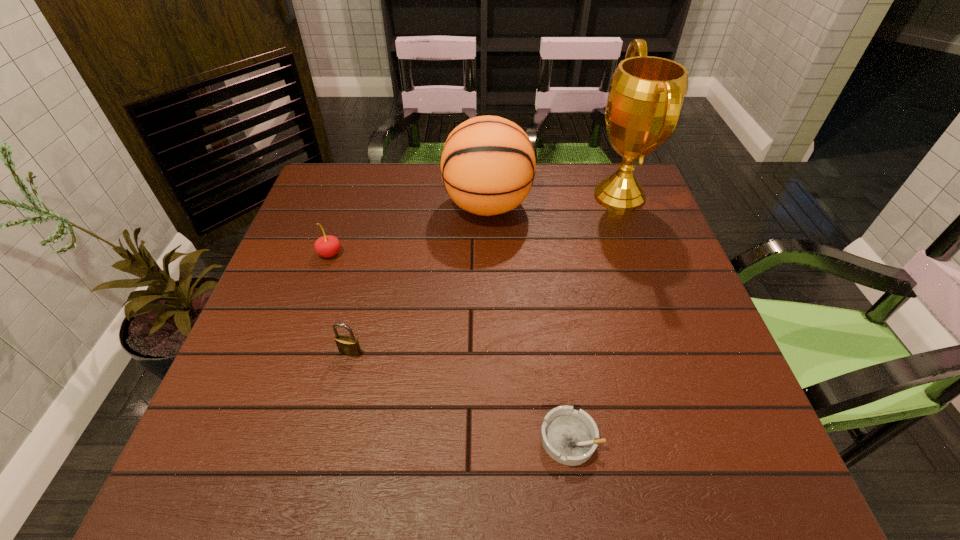
Find the location of a particular element. The width and height of the screenshot is (960, 540). empty space between the nearest object and the cherry is located at coordinates (450, 346).

You are a GUI agent. You are given a task and a screenshot of the screen. Output one action in this format:
    pyautogui.click(x=<x>, y=<y>)
    Task: Click on the free spot between the leftmost object and the fourth farthest object
    
    Given the screenshot: What is the action you would take?
    pyautogui.click(x=341, y=303)

You are a GUI agent. You are given a task and a screenshot of the screen. Output one action in this format:
    pyautogui.click(x=<x>, y=<y>)
    Task: Click on the unoccupied area between the tallest object and the basketball
    This screenshot has width=960, height=540.
    Given the screenshot: What is the action you would take?
    pyautogui.click(x=553, y=201)

Image resolution: width=960 pixels, height=540 pixels. Identify the location of blank region between the nearest object and the basketball. (529, 322).

This screenshot has height=540, width=960. I want to click on vacant space that is in between the padlock and the ashtray, so click(461, 395).

At what (x,y) coordinates should I click in order to perform the action: click on free spot between the rightmost object and the second tallest object. Please return your answer as a coordinate pair (x, y). Looking at the image, I should click on (553, 201).

Where is `vacant point located between the leftmost object and the rightmost object`? This screenshot has width=960, height=540. vacant point located between the leftmost object and the rightmost object is located at coordinates (x=474, y=225).

At what (x,y) coordinates should I click in order to perform the action: click on free spot between the shortest object and the basketball. Please return your answer as a coordinate pair (x, y). Image resolution: width=960 pixels, height=540 pixels. Looking at the image, I should click on (529, 322).

Locate an element on the screen. object that can be found as the closest to the second shortest object is located at coordinates 326,246.

Point out which object is positioned as the fourth nearest to the fourth shortest object. Please provide its 2D coordinates. Your answer should be formatted as a tuple, i.e. [(x, y)], where the tuple contains the x and y coordinates of a point satisfying the conditions above.

[(570, 437)]